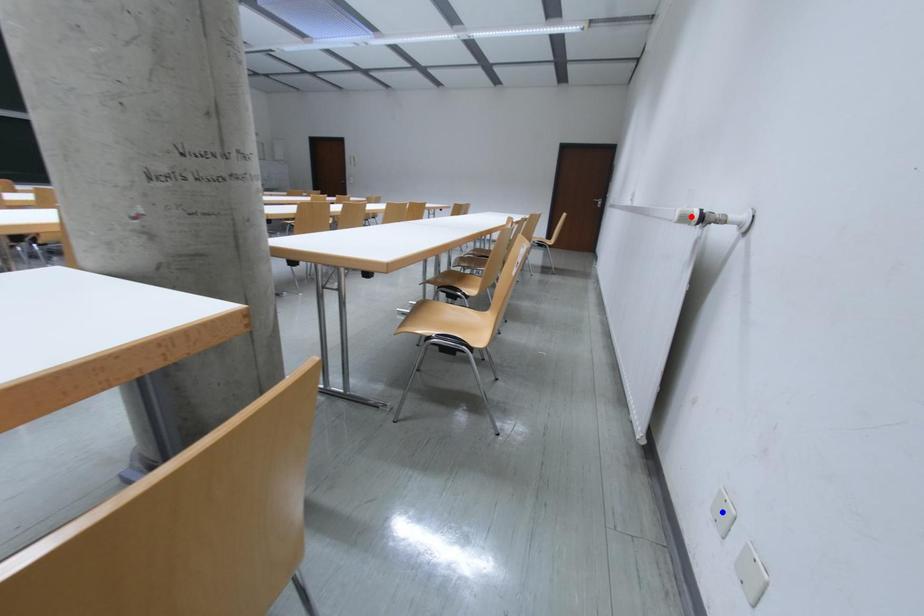
Question: In the image, two points are highlighted. Which point is nearer to the camera? Reply with the corresponding letter.

Choices:
 (A) blue point
 (B) red point

Answer: (A)